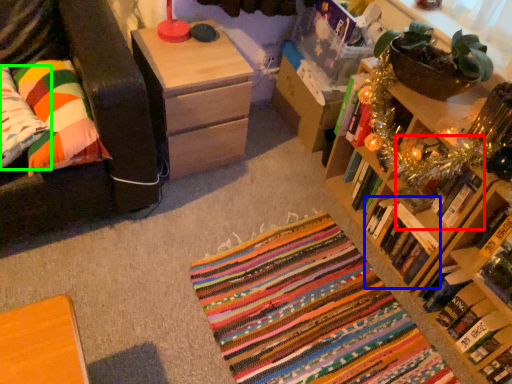
Question: Based on their relative distances, which object is farther from book (highlighted by a red box)? Choose from book (highlighted by a blue box) and pillow (highlighted by a green box).

Choices:
 (A) book
 (B) pillow

Answer: (B)